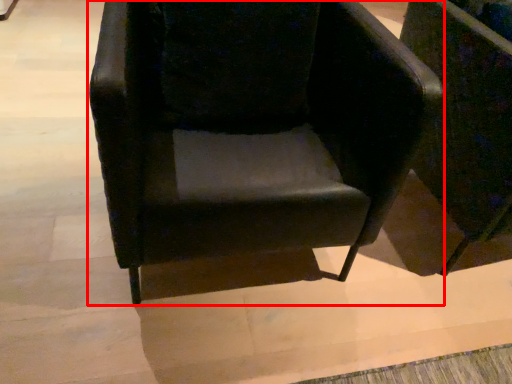
Question: From the image, what is the correct spatial relationship of chair (annotated by the red box) in relation to chair?

Choices:
 (A) right
 (B) left

Answer: (B)